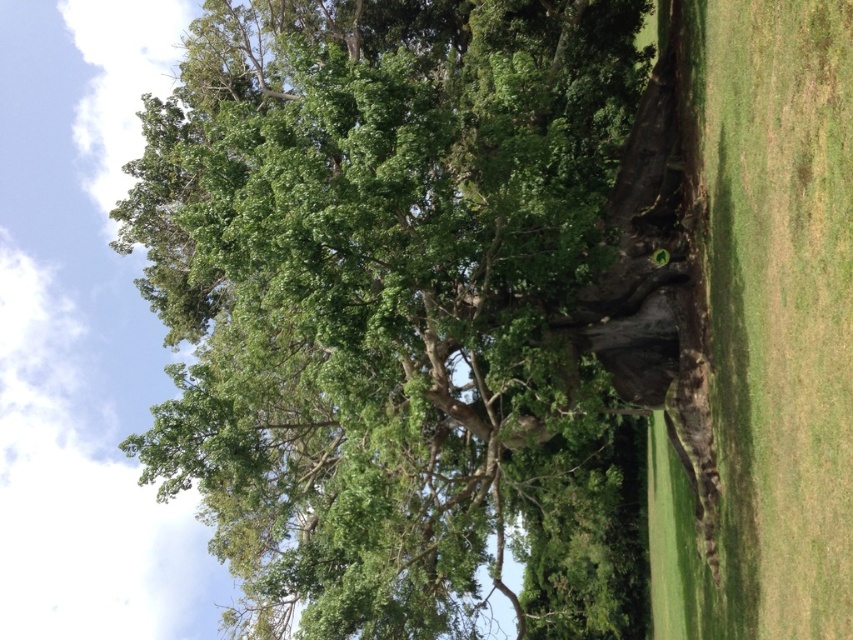
You are standing in a park and see the green leafy tree at center and the green grass at right. Which object is located to the right of the other?

The green grass at right is located to the right of the green leafy tree at center.

You are standing in the park and see the green leafy tree at center and the green grass at right. Which object is closer to the ground?

The green leafy tree at center is closer to the ground than the green grass at right because the tree is below the grass in the image.

You are a gardener planning to plant a new tree in the park. You have a small sapling that needs space. Considering the green leafy tree at center and the green grass at right, which area would be better for planting the sapling to ensure it has enough space to grow?

The green leafy tree at center has a larger size compared to the green grass at right, so planting the sapling near the green grass at right would provide more space for the sapling to grow without competing with the larger tree.